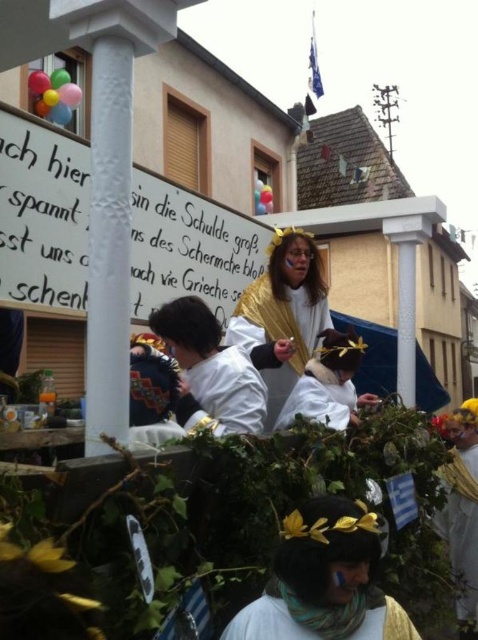
You are a photographer trying to capture a closeup of the gold metallic cape at center and the white fabric headband at center. Which object should you focus on first if you want to ensure both are in focus without moving the camera?

The gold metallic cape at center is located above the white fabric headband at center. Since they are at different heights, you should focus on the gold metallic cape at center first as it is closer to the camera, ensuring both will be in focus with a proper depth of field.

You are a costume designer trying to fit a white matte costume at center onto a mannequin. The mannequin has a head that is 20 cm wide. Can the white fabric headband at center, which is part of the costume, fit around the head without overlapping?

The white fabric headband at center has a width larger than the white matte costume at center. Since the mannequin head is 20 cm wide, the headband should fit without overlapping as its width is sufficient.

You are a photographer standing in the crowd watching the parade. You want to take a photo of both the gold metallic cape at center and the white matte costume at center. Which one should you focus on first to ensure the taller object is in frame?

The gold metallic cape at center is taller than the white matte costume at center, so you should focus on the gold metallic cape at center first to ensure it is fully in frame.